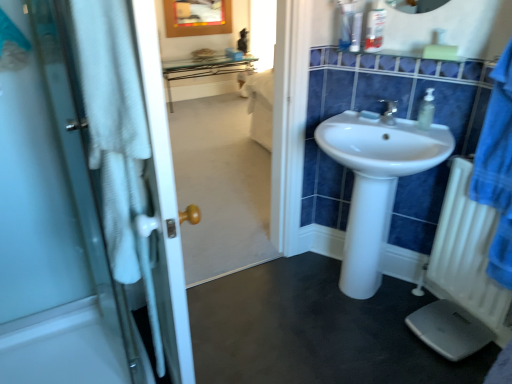
Question: Considering their positions, is white matte soap at center located in front of or behind white plastic radiator at lower right?

Choices:
 (A) behind
 (B) front

Answer: (A)

Question: Is white matte soap at center wider or thinner than white plastic radiator at lower right?

Choices:
 (A) wide
 (B) thin

Answer: (B)

Question: Which is farther from the clear plastic cup at upper center, marked as the second toiletry in a left-to-right arrangement?

Choices:
 (A) white glass door at left
 (B) black rubber mat at lower center
 (C) translucent plastic soap dispenser at upper right
 (D) white matte soap at center
 (E) white glossy sink at center

Answer: (A)

Question: Which of these objects is positioned closest to the transparent plastic cup at upper center, the 1th toiletry from the left?

Choices:
 (A) white glass door at left
 (B) white matte soap at center
 (C) white plastic scale at lower right
 (D) white plastic radiator at lower right
 (E) translucent plastic soap dispenser at upper right

Answer: (B)